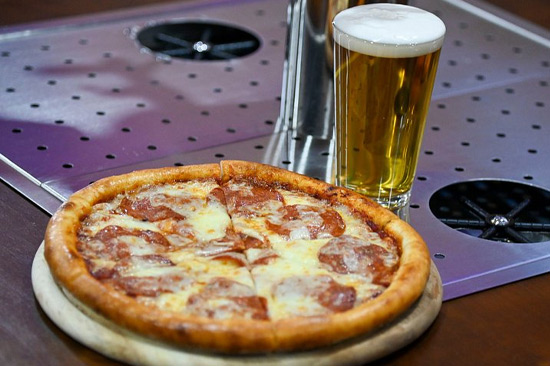
This screenshot has height=366, width=550. Identify the location of table. (514, 334).